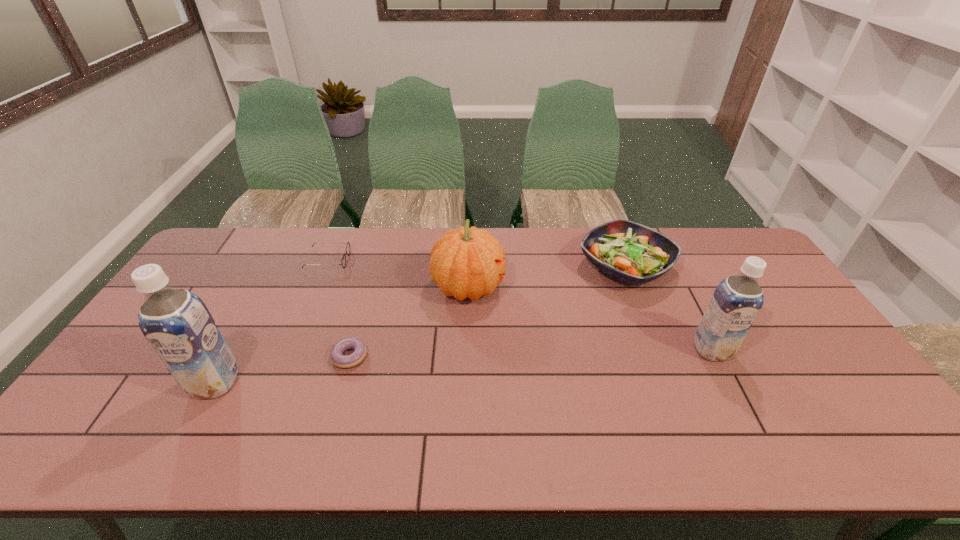
Please mark a free spot for a new soya_milk to balance the arrangement. Please provide its 2D coordinates. Your answer should be formatted as a tuple, i.e. [(x, y)], where the tuple contains the x and y coordinates of a point satisfying the conditions above.

[(472, 366)]